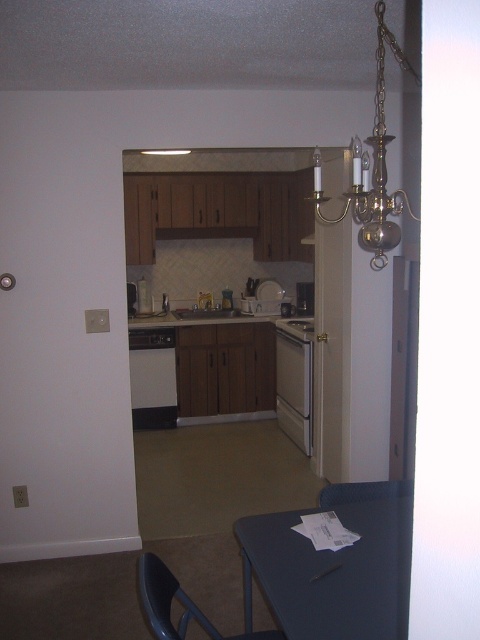
Does white glossy sink at center appear over white glossy stove at center?

Incorrect, white glossy sink at center is not positioned above white glossy stove at center.

The image size is (480, 640). I want to click on white glossy sink at center, so click(205, 314).

Does matte black chair at lower center have a larger size compared to white glossy stove at center?

No.

Does matte black chair at lower center have a smaller size compared to white glossy stove at center?

Indeed, matte black chair at lower center has a smaller size compared to white glossy stove at center.

Does point (323, 490) come farther from viewer compared to point (307, 314)?

No.

Find the location of a particular element. matte black chair at lower center is located at coordinates (362, 492).

Between point (278, 349) and point (162, 634), which one is positioned behind?

The point (278, 349) is more distant.

Can you confirm if satin white oven at center is smaller than black plastic chair at lower center?

Incorrect, satin white oven at center is not smaller in size than black plastic chair at lower center.

Based on the photo, who is more distant from viewer, (295, 365) or (182, 589)?

Positioned behind is point (295, 365).

Locate an element on the screen. The height and width of the screenshot is (640, 480). satin white oven at center is located at coordinates (295, 380).